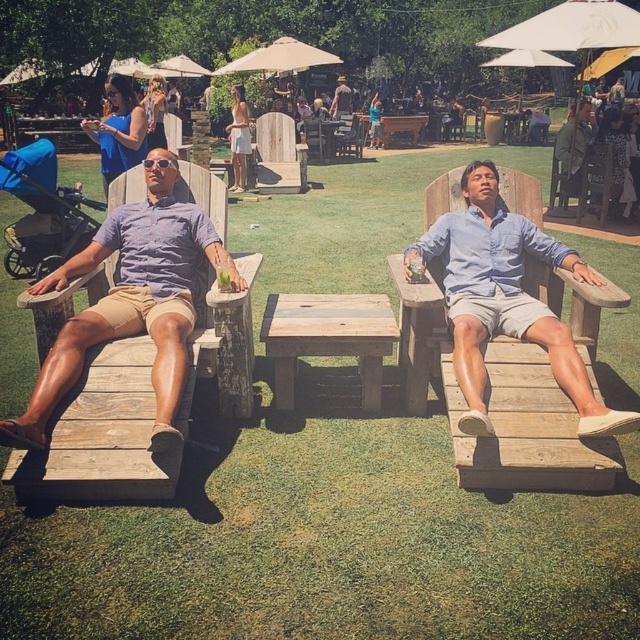
You are organizing a picnic and need to place a red blanket between the matte blue dress at upper left and the wooden chair at right. Based on their positions, where should you place the red blanket?

The matte blue dress at upper left is to the left of the wooden chair at right, so you should place the red blanket between them on the grassy area between the two objects.

You are organizing a photo shoot and need to ensure the matte blue dress at upper left is visible in the frame without being blocked by the wooden chair at right. Based on their positions, is this possible?

The matte blue dress at upper left is above the wooden chair at right, so it will not be blocked by the chair and should be visible in the frame.

You are a photographer trying to capture a candid shot of the people in the scene. You notice the wooden chair at right and the white cotton dress at center. Which object is positioned higher in the frame?

The wooden chair at right is much taller than the white cotton dress at center, so it is positioned higher in the frame.